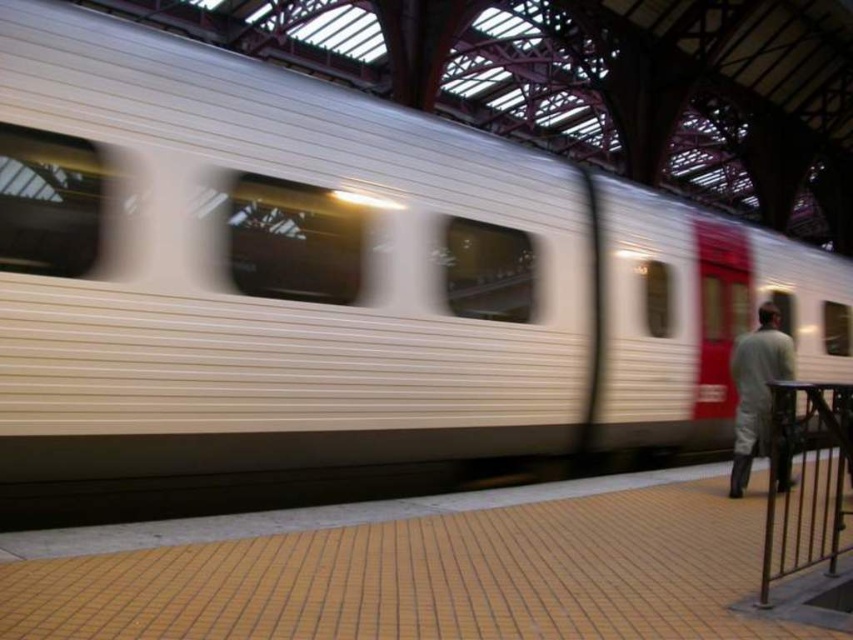
Question: Is metallic silver rail at lower right bigger than gray fabric pants at right?

Choices:
 (A) no
 (B) yes

Answer: (B)

Question: Which point is closer to the camera?

Choices:
 (A) (840, 449)
 (B) (781, 456)

Answer: (B)

Question: Which object appears closest to the camera in this image?

Choices:
 (A) gray fabric pants at right
 (B) metallic silver rail at lower right

Answer: (B)

Question: Which point is farther from the camera taking this photo?

Choices:
 (A) (782, 486)
 (B) (822, 445)

Answer: (B)

Question: Can you confirm if metallic silver rail at lower right is smaller than gray fabric pants at right?

Choices:
 (A) yes
 (B) no

Answer: (B)

Question: Is metallic silver rail at lower right smaller than gray fabric pants at right?

Choices:
 (A) no
 (B) yes

Answer: (A)